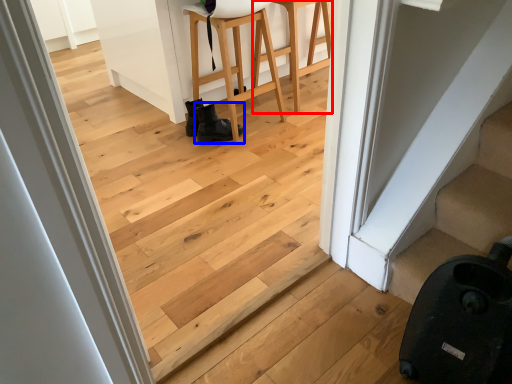
Question: Which object is closer to the camera taking this photo, furniture (highlighted by a red box) or footwear (highlighted by a blue box)?

Choices:
 (A) furniture
 (B) footwear

Answer: (A)